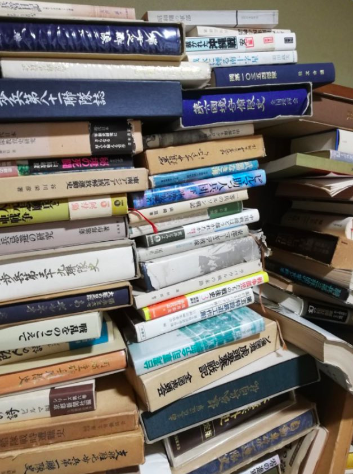
The width and height of the screenshot is (353, 474). In order to click on 3 very large stacks of books in this screenshot , I will do `click(81, 310)`, `click(226, 291)`, `click(309, 261)`.